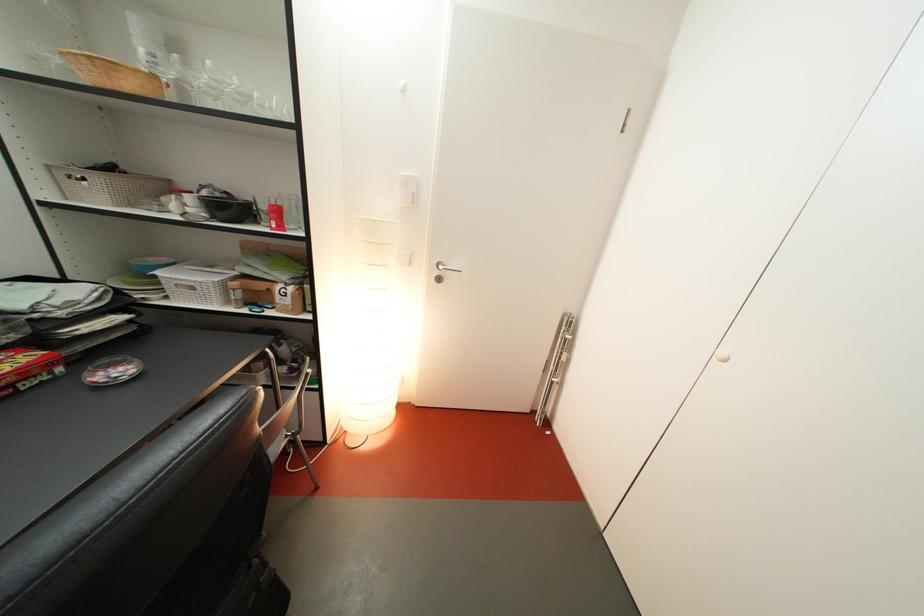
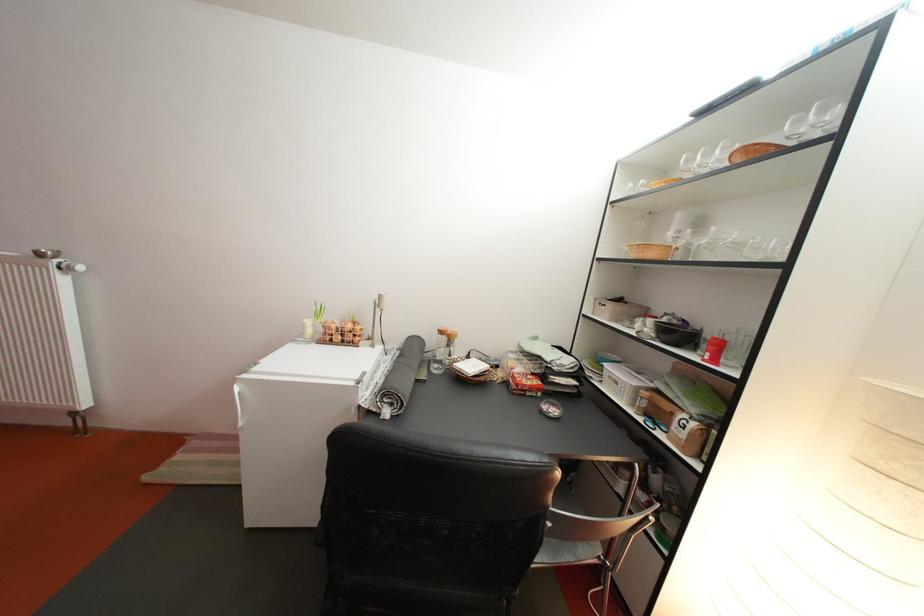
Find the pixel in the second image that matches point 216,200 in the first image.

(675, 326)